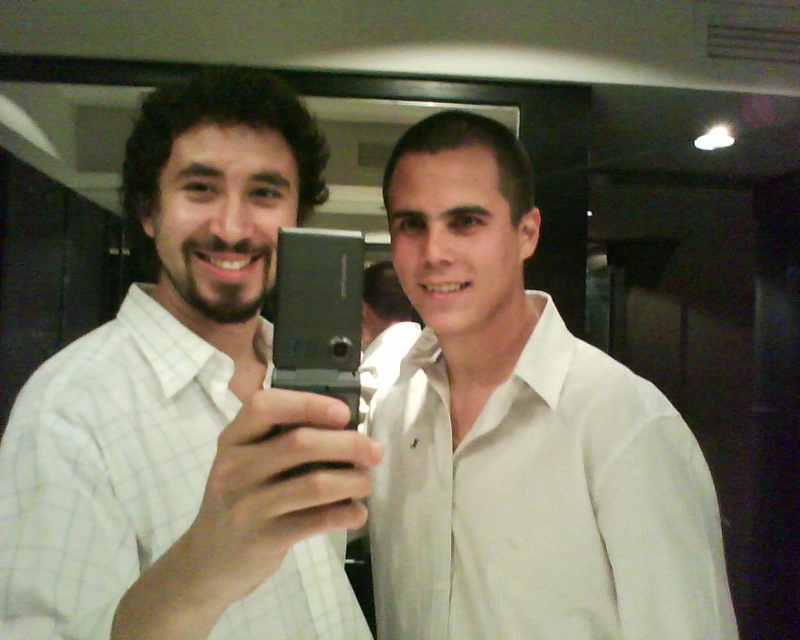
This screenshot has width=800, height=640. What do you see at coordinates (542, 504) in the screenshot? I see `white textured shirt at center` at bounding box center [542, 504].

Which is below, white textured shirt at center or white checkered shirt at center?

white checkered shirt at center is below.

Image resolution: width=800 pixels, height=640 pixels. I want to click on white textured shirt at center, so click(542, 504).